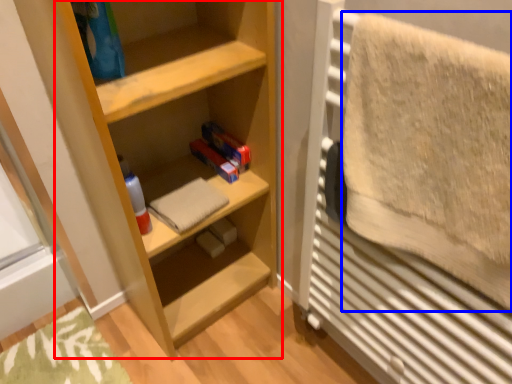
Question: Which object appears closest to the camera in this image, shelf (highlighted by a red box) or bath towel (highlighted by a blue box)?

Choices:
 (A) shelf
 (B) bath towel

Answer: (B)